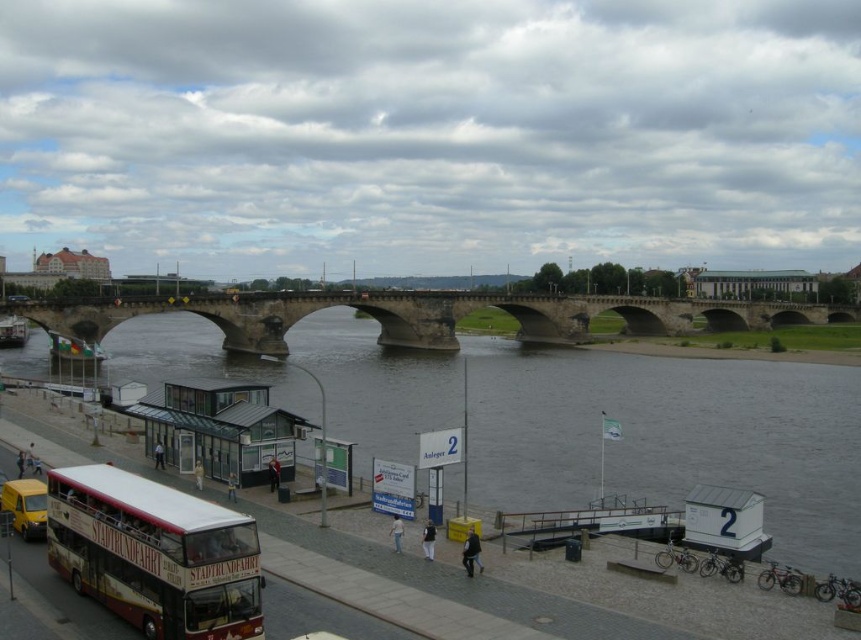
Question: Which of the following is the closest to the observer?

Choices:
 (A) yellow matte bus at lower left
 (B) maroon painted double-decker bus at lower left
 (C) concrete bridge at center

Answer: (B)

Question: Is gray concrete bridge at center thinner than white glass bus station at lower left?

Choices:
 (A) yes
 (B) no

Answer: (B)

Question: Considering the real-world distances, which object is closest to the gray concrete bridge at center?

Choices:
 (A) concrete bridge at center
 (B) maroon painted double-decker bus at lower left
 (C) white glass bus station at lower left

Answer: (A)

Question: Is concrete bridge at center to the right of yellow matte bus at lower left from the viewer's perspective?

Choices:
 (A) yes
 (B) no

Answer: (A)

Question: Can you confirm if maroon painted double-decker bus at lower left is positioned below concrete bridge at center?

Choices:
 (A) yes
 (B) no

Answer: (A)

Question: Considering the real-world distances, which object is farthest from the white glass bus station at lower left?

Choices:
 (A) concrete bridge at center
 (B) maroon painted double-decker bus at lower left
 (C) gray concrete bridge at center

Answer: (A)